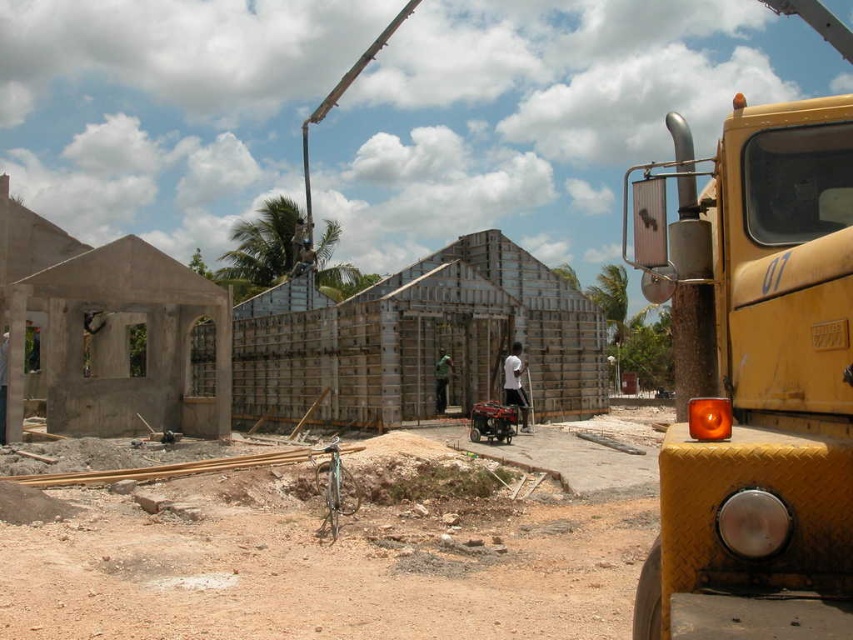
Is yellow metallic school bus at right positioned at the back of black metallic crane at upper center?

No, yellow metallic school bus at right is in front of black metallic crane at upper center.

Is point (838, 195) positioned before point (300, 259)?

That is True.

I want to click on yellow metallic school bus at right, so click(756, 378).

Can you confirm if brown dirt track at center is positioned to the right of black metallic crane at upper center?

Yes, brown dirt track at center is to the right of black metallic crane at upper center.

You are a GUI agent. You are given a task and a screenshot of the screen. Output one action in this format:
    pyautogui.click(x=<x>, y=<y>)
    Task: Click on the brown dirt track at center
    
    Given the screenshot: What is the action you would take?
    pyautogui.click(x=341, y=548)

Is point (650, 276) farther from viewer compared to point (436, 388)?

That is False.

Does yellow metallic school bus at right have a smaller size compared to dark green fabric at center?

No, yellow metallic school bus at right is not smaller than dark green fabric at center.

Image resolution: width=853 pixels, height=640 pixels. Describe the element at coordinates (756, 378) in the screenshot. I see `yellow metallic school bus at right` at that location.

Locate an element on the screen. The height and width of the screenshot is (640, 853). yellow metallic school bus at right is located at coordinates (756, 378).